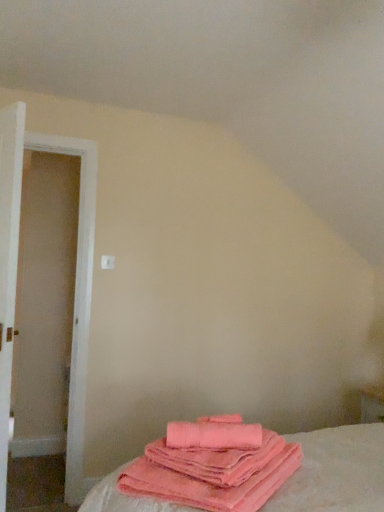
Question: From a real-world perspective, relative to pink plush towels at lower center, is white wooden door at left vertically above or below?

Choices:
 (A) below
 (B) above

Answer: (B)

Question: Would you say white wooden door at left is to the left or to the right of pink plush towels at lower center in the picture?

Choices:
 (A) left
 (B) right

Answer: (A)

Question: Estimate the real-world distances between objects in this image. Which object is closer to the white wooden door at left?

Choices:
 (A) pink soft cotton towels at lower center
 (B) pink plush towels at lower center

Answer: (A)

Question: Which object is the closest to the pink soft cotton towels at lower center?

Choices:
 (A) pink plush towels at lower center
 (B) white wooden door at left

Answer: (A)